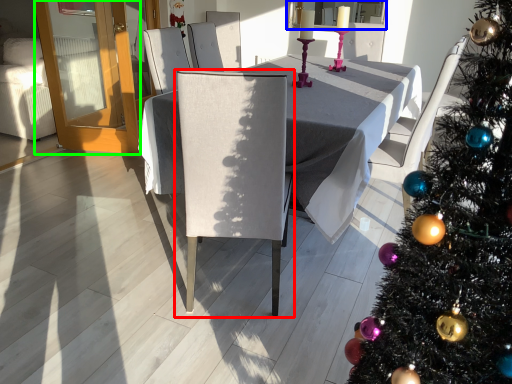
Question: Based on their relative distances, which object is nearer to chair (highlighted by a red box)? Choose from window screen (highlighted by a blue box) and glass door (highlighted by a green box).

Choices:
 (A) window screen
 (B) glass door

Answer: (B)